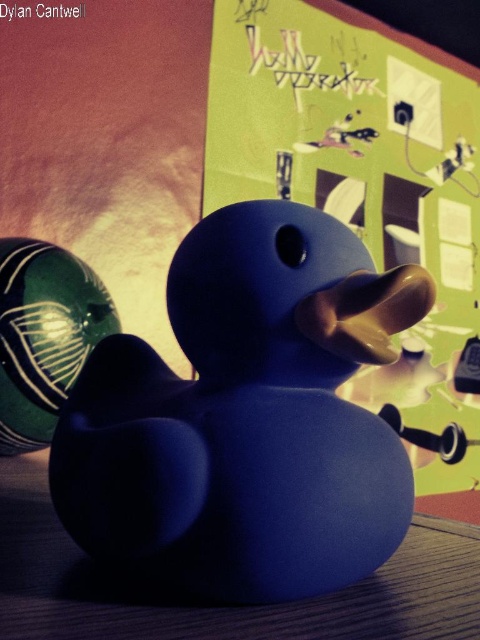
Question: Is the position of matte blue rubber duck at center less distant than that of wooden table at center?

Choices:
 (A) yes
 (B) no

Answer: (B)

Question: Based on their relative distances, which object is nearer to the matte green bulletin board at center?

Choices:
 (A) wooden table at center
 (B) matte blue rubber duck at center

Answer: (B)

Question: Which is nearer to the wooden table at center?

Choices:
 (A) matte green bulletin board at center
 (B) green glossy ball at left

Answer: (B)

Question: Can you confirm if matte green bulletin board at center is thinner than green glossy ball at left?

Choices:
 (A) yes
 (B) no

Answer: (B)

Question: Estimate the real-world distances between objects in this image. Which object is closer to the matte blue rubber duck at center?

Choices:
 (A) matte green bulletin board at center
 (B) wooden table at center

Answer: (B)

Question: Is matte blue rubber duck at center to the right of wooden table at center from the viewer's perspective?

Choices:
 (A) yes
 (B) no

Answer: (A)